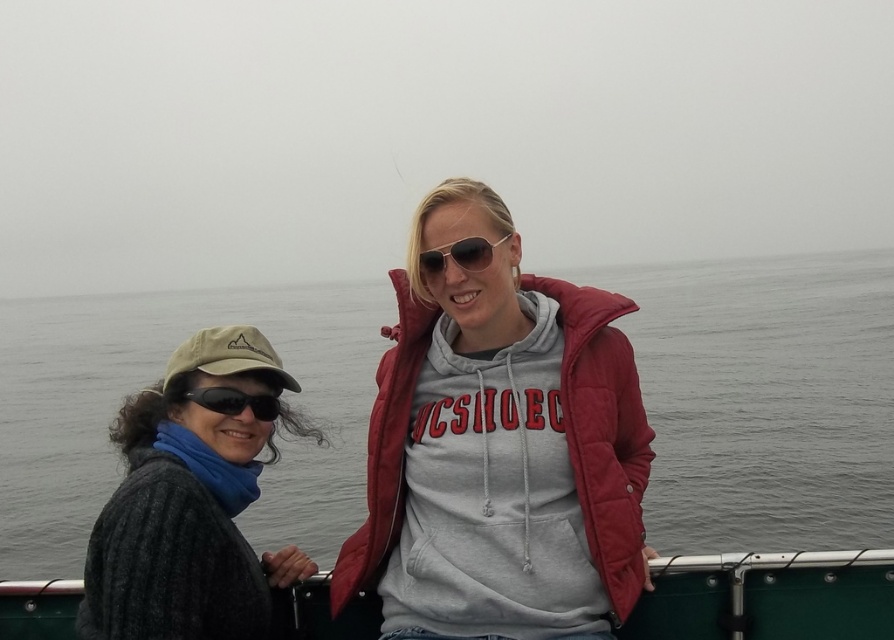
You are a photographer trying to capture a wide shot of the scene. Given that the gray water at center and the black matte sunglasses at left are both in your frame, which object will occupy a larger portion of the photo?

The gray water at center will occupy a larger portion of the photo because its width is larger than the black matte sunglasses at left.

You are standing at point (500, 448) in the image. What object are you standing on?

You are standing on the matte gray hoodie at center.